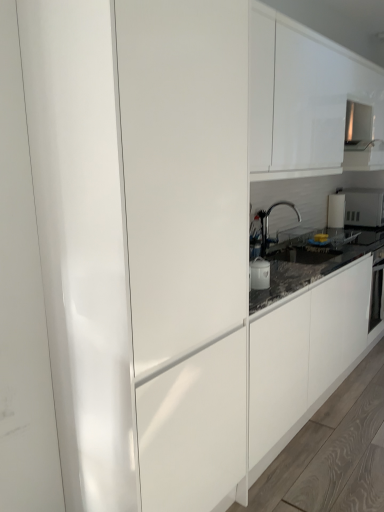
Question: Is white glossy cabinet at upper center facing towards matte white cabinet at center?

Choices:
 (A) no
 (B) yes

Answer: (A)

Question: Is white glossy cabinet at upper center in contact with matte white cabinet at center?

Choices:
 (A) yes
 (B) no

Answer: (B)

Question: Is white glossy cabinet at upper center at the left side of matte white cabinet at center?

Choices:
 (A) yes
 (B) no

Answer: (B)

Question: From the image's perspective, is white glossy cabinet at upper center over matte white cabinet at center?

Choices:
 (A) yes
 (B) no

Answer: (A)

Question: From a real-world perspective, is white glossy cabinet at upper center on matte white cabinet at center?

Choices:
 (A) yes
 (B) no

Answer: (A)

Question: Can matte white cabinet at center be found inside white glossy cabinet at upper center?

Choices:
 (A) yes
 (B) no

Answer: (B)

Question: Does satin nickel faucet at center have a lesser height compared to white glossy cabinet at upper center?

Choices:
 (A) yes
 (B) no

Answer: (A)

Question: Are satin nickel faucet at center and white glossy cabinet at upper center located far from each other?

Choices:
 (A) no
 (B) yes

Answer: (A)

Question: Is satin nickel faucet at center at the right side of white glossy cabinet at upper center?

Choices:
 (A) yes
 (B) no

Answer: (B)

Question: From a real-world perspective, is satin nickel faucet at center on top of white glossy cabinet at upper center?

Choices:
 (A) yes
 (B) no

Answer: (B)

Question: Is satin nickel faucet at center facing towards white glossy cabinet at upper center?

Choices:
 (A) yes
 (B) no

Answer: (B)

Question: Considering the relative sizes of satin nickel faucet at center and white glossy cabinet at upper center in the image provided, is satin nickel faucet at center wider than white glossy cabinet at upper center?

Choices:
 (A) yes
 (B) no

Answer: (B)

Question: Is white glossy microwave at upper right, the 1th appliance viewed from the back, next to matte white cabinet at center?

Choices:
 (A) no
 (B) yes

Answer: (A)